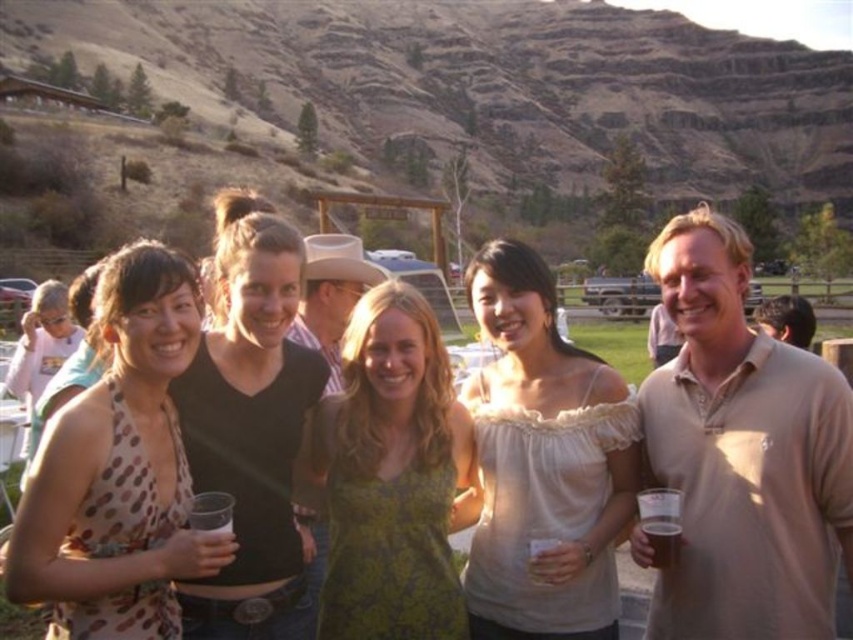
You are a photographer trying to capture a closeup shot of the matte plastic cup at center. There is a green textured tank top at center blocking your view. Which direction should you move to avoid the obstruction?

The green textured tank top at center is to the left of the matte plastic cup at center. To avoid the obstruction, move to the right side of the green textured tank top at center to get a clear view of the matte plastic cup at center.

You are a photographer trying to capture a closeup of the green textured tank top at center without including the translucent plastic cup at lower right in the frame. Given their relative sizes, which object would require a wider angle lens to fully capture in the photo?

The green textured tank top at center requires a wider angle lens because it is wider than the translucent plastic cup at lower right.

You are a photographer trying to capture the group photo. You need to ensure that the brown leather cowboy hat at center and the light brown hair at left are both visible in the frame. Given their sizes, which object might require you to adjust your camera angle to prevent it from being too small in the photo?

The brown leather cowboy hat at center is smaller than the light brown hair at left, so you might need to adjust the camera angle to ensure the hat is not too small in the photo.